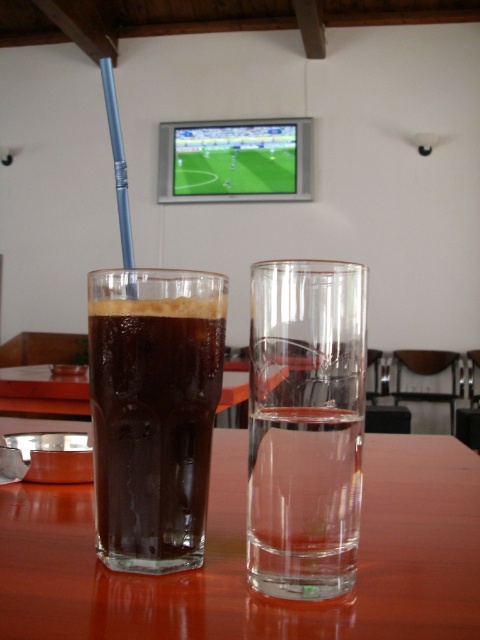
You are sitting at a table in a cafe and want to place your phone on the transparent glass table at center. However, you notice the dark matte glass at left nearby. Which object should you place your phone on to avoid it slipping off?

You should place your phone on the dark matte glass at left because the transparent glass table at center is positioned on the right side of it, meaning the dark matte glass at left is more stable and less slippery.

You are a server in a restaurant and need to place a 12 inch wide tray between the transparent glass table at center and the dark matte glass at left. Can the tray fit horizontally between them?

The transparent glass table at center is wider than the dark matte glass at left, but the description only provides information about their widths, not the distance between them. Therefore, it is impossible to determine if the 12 inch wide tray can fit horizontally between them based on the given information.